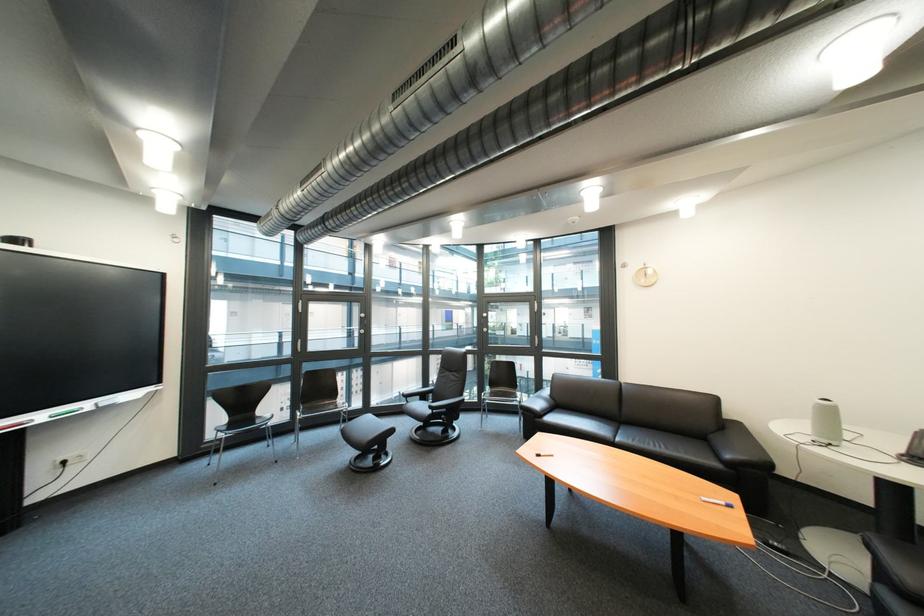
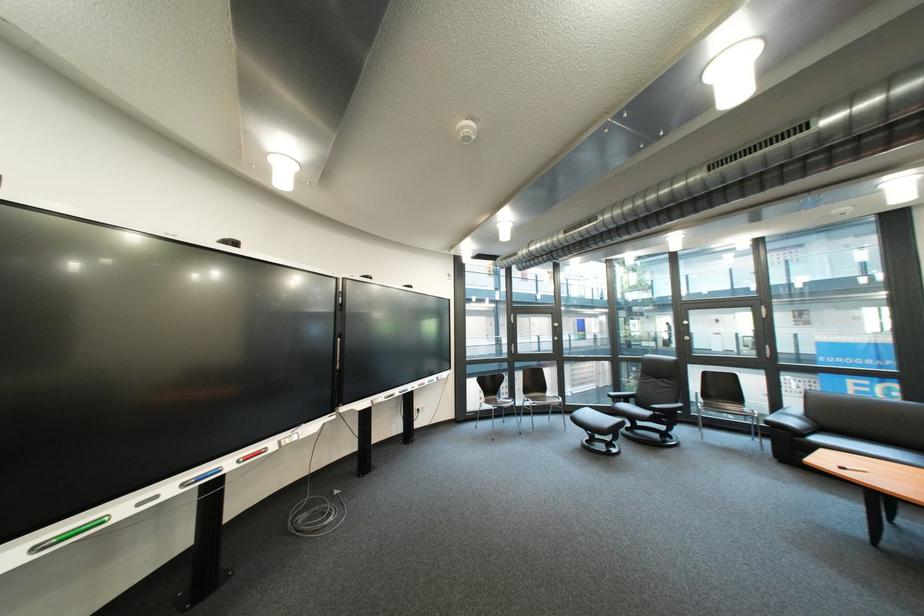
The point at (283, 447) is marked in the first image. Where is the corresponding point in the second image?

(517, 424)